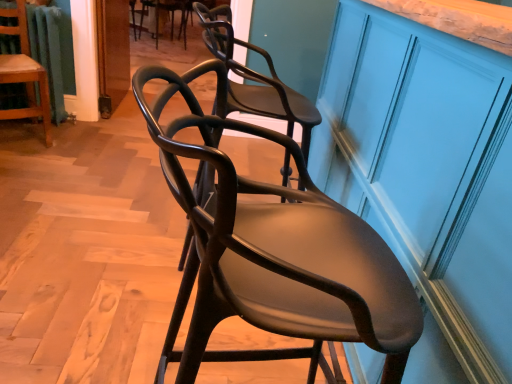
At what (x,y) coordinates should I click in order to perform the action: click on vacant space to the right of wooden chair at left, placed as the third chair when sorted from right to left. Please return your answer as a coordinate pair (x, y). The width and height of the screenshot is (512, 384). Looking at the image, I should click on (79, 139).